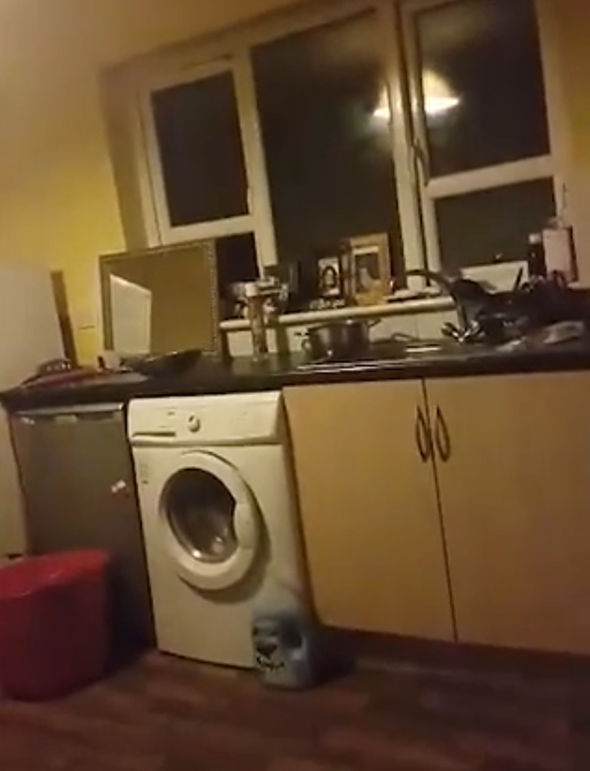
This screenshot has height=771, width=590. Find the location of `pot`. pot is located at coordinates (333, 331).